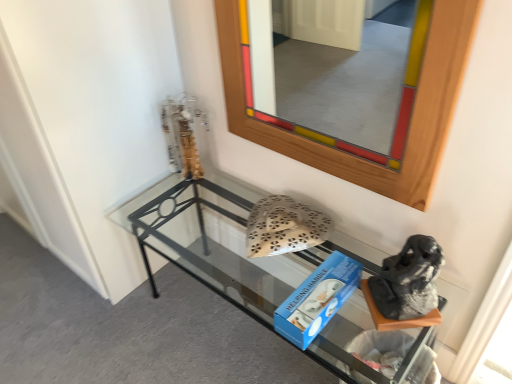
What is the approximate height of metallic gold sculpture at upper left?

36.84 centimeters.

This screenshot has width=512, height=384. What do you see at coordinates (183, 134) in the screenshot? I see `metallic gold sculpture at upper left` at bounding box center [183, 134].

Describe the element at coordinates (219, 242) in the screenshot. I see `clear glass shelf at lower center` at that location.

Measure the distance between point [401,273] and camera.

1.11 meters.

Where is `wooden frame at upper center`? This screenshot has width=512, height=384. wooden frame at upper center is located at coordinates click(338, 71).

Can you confirm if gray fabric boot at lower right is positioned to the left of clear glass shelf at lower center?

No, gray fabric boot at lower right is not to the left of clear glass shelf at lower center.

Which of these two, gray fabric boot at lower right or clear glass shelf at lower center, is bigger?

clear glass shelf at lower center is bigger.

From their relative heights in the image, would you say gray fabric boot at lower right is taller or shorter than clear glass shelf at lower center?

Clearly, gray fabric boot at lower right is shorter compared to clear glass shelf at lower center.

Considering the points (388, 289) and (142, 233), which point is behind, point (388, 289) or point (142, 233)?

The point (142, 233) is more distant.

Visually, is wooden frame at upper center positioned to the left or to the right of metallic gold sculpture at upper left?

wooden frame at upper center is positioned on metallic gold sculpture at upper left's right side.

Looking at this image, measure the distance from wooden frame at upper center to metallic gold sculpture at upper left.

wooden frame at upper center and metallic gold sculpture at upper left are 5.77 feet apart.

From the image's perspective, between wooden frame at upper center and metallic gold sculpture at upper left, who is located below?

metallic gold sculpture at upper left, from the image's perspective.

Who is taller, wooden frame at upper center or metallic gold sculpture at upper left?

With more height is wooden frame at upper center.

You are a GUI agent. You are given a task and a screenshot of the screen. Output one action in this format:
    pyautogui.click(x=<x>, y=<y>)
    Task: Click on the footwear below the wooden frame at upper center (from a real-world perspective)
    The height and width of the screenshot is (384, 512).
    Given the screenshot: What is the action you would take?
    pyautogui.click(x=408, y=280)

Looking at the image, does wooden frame at upper center seem bigger or smaller compared to gray fabric boot at lower right?

wooden frame at upper center is bigger than gray fabric boot at lower right.

Considering the positions of point (358, 89) and point (402, 316), is point (358, 89) closer or farther from the camera than point (402, 316)?

Point (358, 89).

Between metallic gold sculpture at upper left and gray fabric boot at lower right, which one is positioned in front?

gray fabric boot at lower right.

Can you confirm if metallic gold sculpture at upper left is bigger than gray fabric boot at lower right?

No, metallic gold sculpture at upper left is not bigger than gray fabric boot at lower right.

From the image's perspective, which is above, metallic gold sculpture at upper left or gray fabric boot at lower right?

metallic gold sculpture at upper left appears higher in the image.

From the image's perspective, which one is positioned higher, clear glass shelf at lower center or metallic gold sculpture at upper left?

From the image's view, metallic gold sculpture at upper left is above.

Is metallic gold sculpture at upper left located within clear glass shelf at lower center?

No, metallic gold sculpture at upper left is not inside clear glass shelf at lower center.

Is point (172, 221) positioned after point (183, 156)?

That is True.

From a real-world perspective, does clear glass shelf at lower center stand above metallic gold sculpture at upper left?

No, from a real-world perspective, clear glass shelf at lower center is not over metallic gold sculpture at upper left

Which of these two, gray fabric boot at lower right or wooden frame at upper center, stands shorter?

Standing shorter between the two is gray fabric boot at lower right.

Which of these two, gray fabric boot at lower right or wooden frame at upper center, is smaller?

gray fabric boot at lower right is smaller.

Consider the image. How many degrees apart are the facing directions of gray fabric boot at lower right and wooden frame at upper center?

46.2 degrees.

Is gray fabric boot at lower right turned away from wooden frame at upper center?

No.

Is wooden frame at upper center located within metallic gold sculpture at upper left?

Definitely not — wooden frame at upper center is not inside metallic gold sculpture at upper left.

From a real-world perspective, is metallic gold sculpture at upper left positioned above or below wooden frame at upper center?

In terms of real-world spatial position, metallic gold sculpture at upper left is below wooden frame at upper center.

Is metallic gold sculpture at upper left thinner than wooden frame at upper center?

No, metallic gold sculpture at upper left is not thinner than wooden frame at upper center.

In the scene shown: Looking at the image, does metallic gold sculpture at upper left seem bigger or smaller compared to wooden frame at upper center?

metallic gold sculpture at upper left is smaller than wooden frame at upper center.

The image size is (512, 384). I want to click on shelf below the gray fabric boot at lower right (from the image's perspective), so coord(219,242).

Identify the location of sculpture below the wooden frame at upper center (from a real-world perspective). This screenshot has width=512, height=384. point(183,134).

From the image, which object appears to be farther from clear glass shelf at lower center, wooden frame at upper center or gray fabric boot at lower right?

Among the two, wooden frame at upper center is located further to clear glass shelf at lower center.

Considering their positions, is metallic gold sculpture at upper left positioned closer to wooden frame at upper center than clear glass shelf at lower center?

clear glass shelf at lower center is positioned closer to the anchor wooden frame at upper center.

From the image, which object appears to be farther from metallic gold sculpture at upper left, clear glass shelf at lower center or gray fabric boot at lower right?

gray fabric boot at lower right is positioned further to the anchor metallic gold sculpture at upper left.

When comparing their distances from clear glass shelf at lower center, does metallic gold sculpture at upper left or wooden frame at upper center seem further?

Based on the image, wooden frame at upper center appears to be further to clear glass shelf at lower center.

Which object lies nearer to the anchor point clear glass shelf at lower center, metallic gold sculpture at upper left or gray fabric boot at lower right?

metallic gold sculpture at upper left is positioned closer to the anchor clear glass shelf at lower center.

From the image, which object appears to be nearer to wooden frame at upper center, clear glass shelf at lower center or gray fabric boot at lower right?

clear glass shelf at lower center.

When comparing their distances from wooden frame at upper center, does gray fabric boot at lower right or clear glass shelf at lower center seem closer?

clear glass shelf at lower center lies closer to wooden frame at upper center than the other object.

From the image, which object appears to be nearer to metallic gold sculpture at upper left, gray fabric boot at lower right or wooden frame at upper center?

gray fabric boot at lower right.

The width and height of the screenshot is (512, 384). What are the coordinates of `shelf located between wooden frame at upper center and metallic gold sculpture at upper left in the depth direction` in the screenshot? It's located at (219, 242).

At what (x,y) coordinates should I click in order to perform the action: click on footwear between wooden frame at upper center and clear glass shelf at lower center vertically. Please return your answer as a coordinate pair (x, y). Looking at the image, I should click on (408, 280).

This screenshot has height=384, width=512. In order to click on shelf between metallic gold sculpture at upper left and gray fabric boot at lower right from left to right in this screenshot , I will do `click(219, 242)`.

You are a GUI agent. You are given a task and a screenshot of the screen. Output one action in this format:
    pyautogui.click(x=<x>, y=<y>)
    Task: Click on the mirror between metallic gold sculpture at upper left and gray fabric boot at lower right from left to right
    
    Given the screenshot: What is the action you would take?
    pyautogui.click(x=338, y=71)